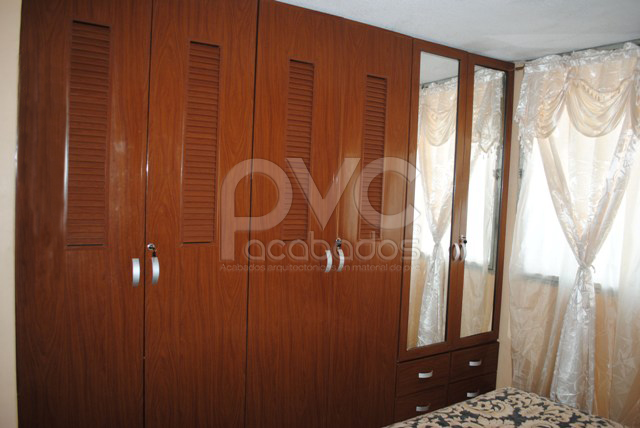
At what (x,y) coordinates should I click in order to perform the action: click on reflection of white curtains in mirror. Please return your answer as a coordinate pair (x, y). The height and width of the screenshot is (428, 640). Looking at the image, I should click on (436, 312), (473, 307).